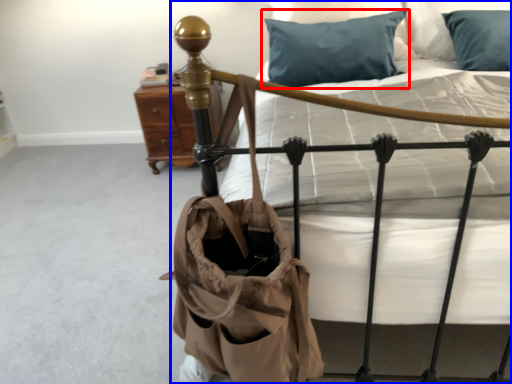
Question: Among these objects, which one is nearest to the camera, pillow (highlighted by a red box) or bed (highlighted by a blue box)?

Choices:
 (A) pillow
 (B) bed

Answer: (B)